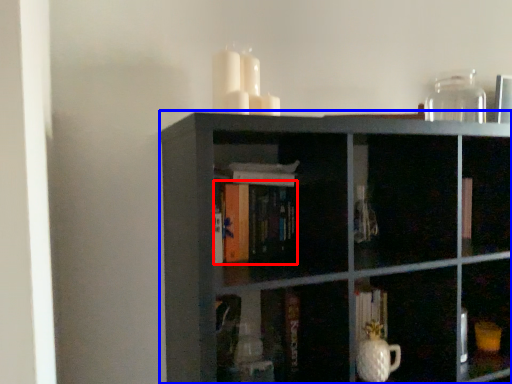
Question: Which object appears farthest to the camera in this image, book (highlighted by a red box) or shelf (highlighted by a blue box)?

Choices:
 (A) book
 (B) shelf

Answer: (A)